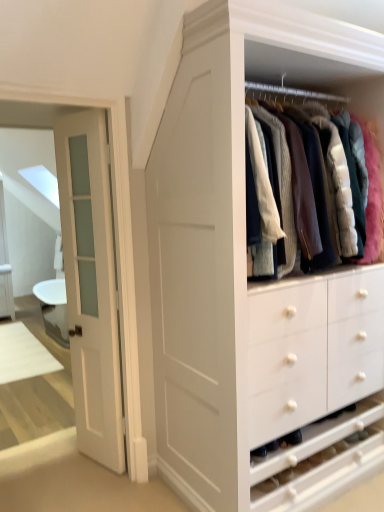
The height and width of the screenshot is (512, 384). What are the coordinates of `vacant space underneath white glossy door at left (from a real-world perspective)` in the screenshot? It's located at (100, 466).